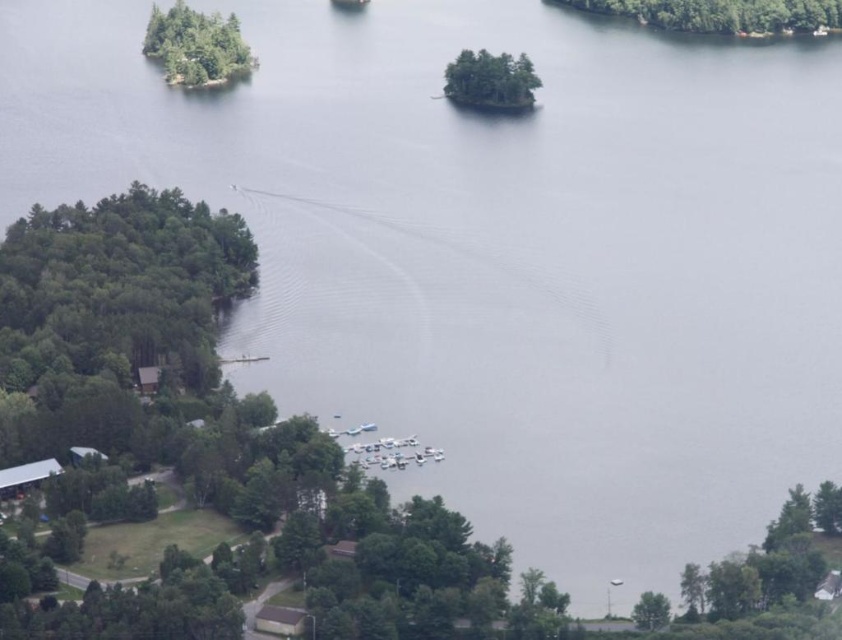
You are standing at the camera position overlooking the lakeside scene. There is a point marked at coordinates point (190, 42). Can you reach this point by walking directly towards it from your current position without any obstacles?

The point (190, 42) is 638.08 meters away from the camera. Since there are no obstacles mentioned in the scene description, you can walk directly towards it.

You are standing at the lakeside and want to reach a specific point marked as point [774,28]. Given that your walking speed is 1.5 meters per second, how many minutes will it take you to reach that point?

The distance between you and point [774,28] is 653.06 meters. At a walking speed of 1.5 meters per second, it would take approximately 435.37 seconds, which is about 7.26 minutes. Therefore, it will take approximately 7.26 minutes to reach the point.

You are a bird flying over the lakeside scene. You want to land on the green leafy trees at upper right. Based on the coordinates provided, can you confirm if the trees are located in the upper right quadrant of the image?

The green leafy trees at upper right are located at coordinates point (723, 13). Since the upper right quadrant typically spans from 0.5 to 1.0 on the x and y axes, the trees are actually positioned in the upper left quadrant of the image, not the upper right.